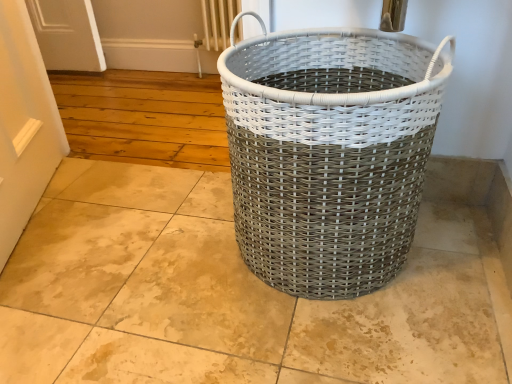
Where is `white woven basket at center`? This screenshot has width=512, height=384. white woven basket at center is located at coordinates (329, 153).

What do you see at coordinates (329, 153) in the screenshot?
I see `white woven basket at center` at bounding box center [329, 153].

Find the location of a particular element. The image size is (512, 384). white woven basket at center is located at coordinates (329, 153).